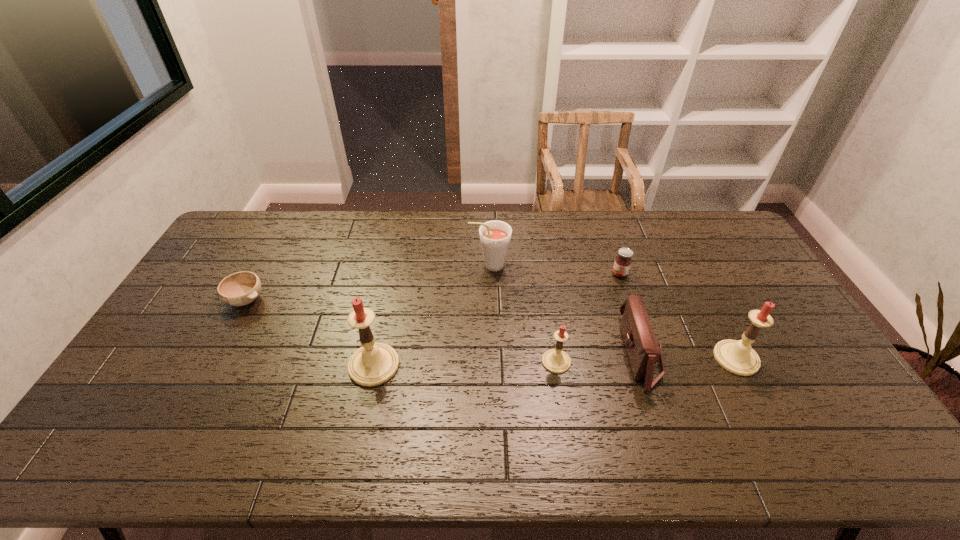
Find the location of a particular element. the leftmost candle is located at coordinates (x=373, y=364).

Where is `the shortest candle`? the shortest candle is located at coordinates click(557, 361).

I want to click on the fourth object from right to left, so click(557, 361).

The image size is (960, 540). Find the location of `the rightmost object`. the rightmost object is located at coordinates (738, 357).

Where is `the rightmost candle`? The image size is (960, 540). the rightmost candle is located at coordinates (738, 357).

Locate an element on the screen. The height and width of the screenshot is (540, 960). the shortest object is located at coordinates (241, 288).

The width and height of the screenshot is (960, 540). Identify the location of bowl. (241, 288).

Find the location of a particular element. The height and width of the screenshot is (540, 960). the third object from left to right is located at coordinates (495, 235).

What are the coordinates of `shoulder bag` in the screenshot? It's located at (643, 349).

You are a GUI agent. You are given a task and a screenshot of the screen. Output one action in this format:
    pyautogui.click(x=<x>, y=<y>)
    Task: Click on the sixth tallest object
    Image resolution: width=960 pixels, height=540 pixels.
    Given the screenshot: What is the action you would take?
    pyautogui.click(x=622, y=263)